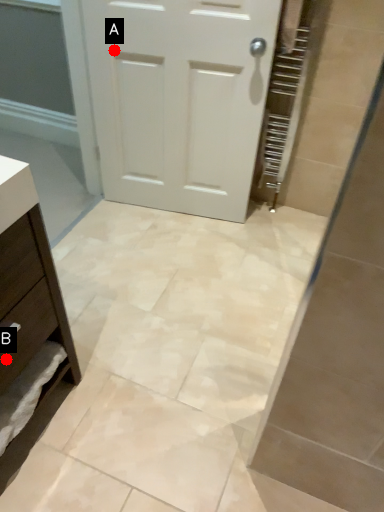
Question: Two points are circled on the image, labeled by A and B beside each circle. Which point is farther to the camera?

Choices:
 (A) A is further
 (B) B is further

Answer: (A)